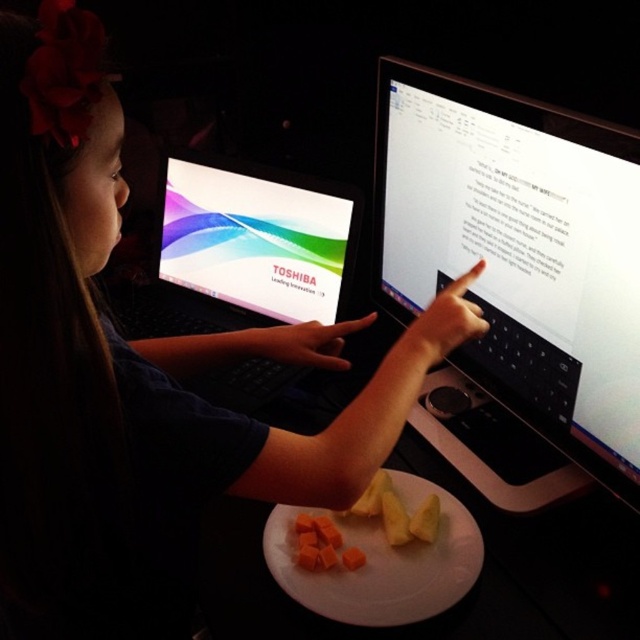
Question: Considering the real-world distances, which object is closest to the orange rubbery carrot at center?

Choices:
 (A) black plastic laptop at center
 (B) matte black monitor at center
 (C) shiny plastic laptop at center
 (D) yellow matte pineapple at center

Answer: (D)

Question: Can you confirm if orange rubbery carrot at center is positioned above yellow matte pineapple at center?

Choices:
 (A) no
 (B) yes

Answer: (A)

Question: Which object is positioned closest to the white matte plate at center?

Choices:
 (A) matte black monitor at center
 (B) yellow matte pineapple at center

Answer: (B)

Question: Among these points, which one is nearest to the camera?

Choices:
 (A) (433, 513)
 (B) (252, 205)
 (C) (166, 157)

Answer: (A)

Question: Is shiny plastic laptop at center positioned behind white matte plate at center?

Choices:
 (A) yes
 (B) no

Answer: (A)

Question: Is matte black monitor at center thinner than yellow matte pineapple at center?

Choices:
 (A) no
 (B) yes

Answer: (A)